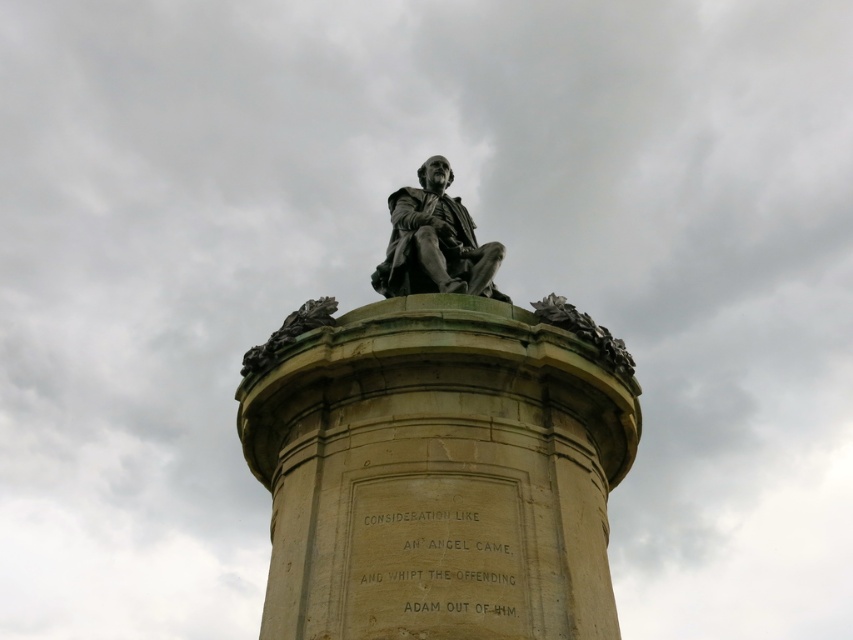
Describe the element at coordinates (438, 474) in the screenshot. I see `stone column at center` at that location.

Who is positioned more to the right, stone column at center or bronze statue at center?

stone column at center

The height and width of the screenshot is (640, 853). I want to click on stone column at center, so click(438, 474).

The image size is (853, 640). Identify the location of stone column at center. (438, 474).